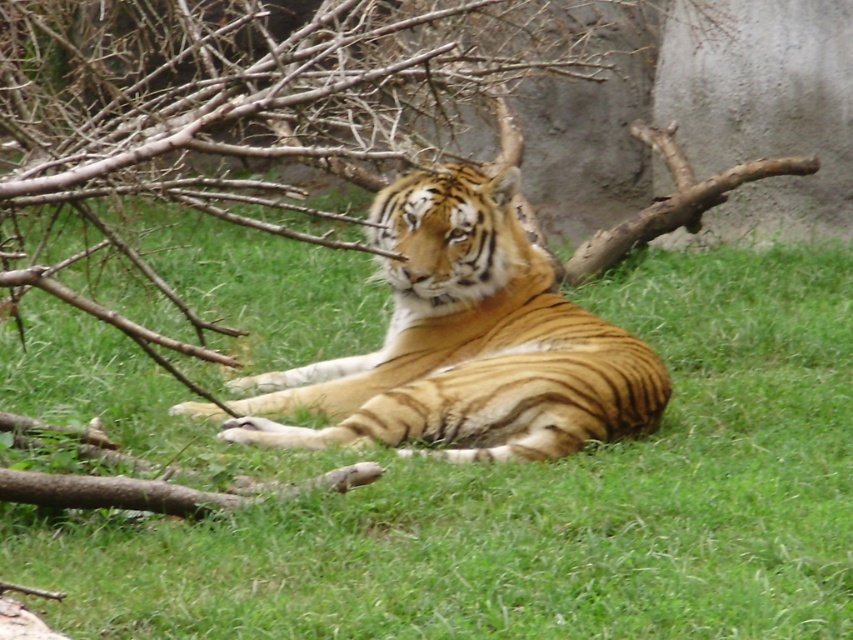
Question: Which object is closer to the camera taking this photo?

Choices:
 (A) golden fur tiger at center
 (B) green grass at center

Answer: (B)

Question: Which of the following is the closest to the observer?

Choices:
 (A) golden fur tiger at center
 (B) green grass at center

Answer: (B)

Question: In this image, where is green grass at center located relative to golden fur tiger at center?

Choices:
 (A) right
 (B) left

Answer: (B)

Question: Is the position of green grass at center less distant than that of golden fur tiger at center?

Choices:
 (A) yes
 (B) no

Answer: (A)

Question: Which point appears closest to the camera in this image?

Choices:
 (A) (380, 218)
 (B) (488, 524)

Answer: (B)

Question: Is green grass at center positioned at the back of golden fur tiger at center?

Choices:
 (A) no
 (B) yes

Answer: (A)